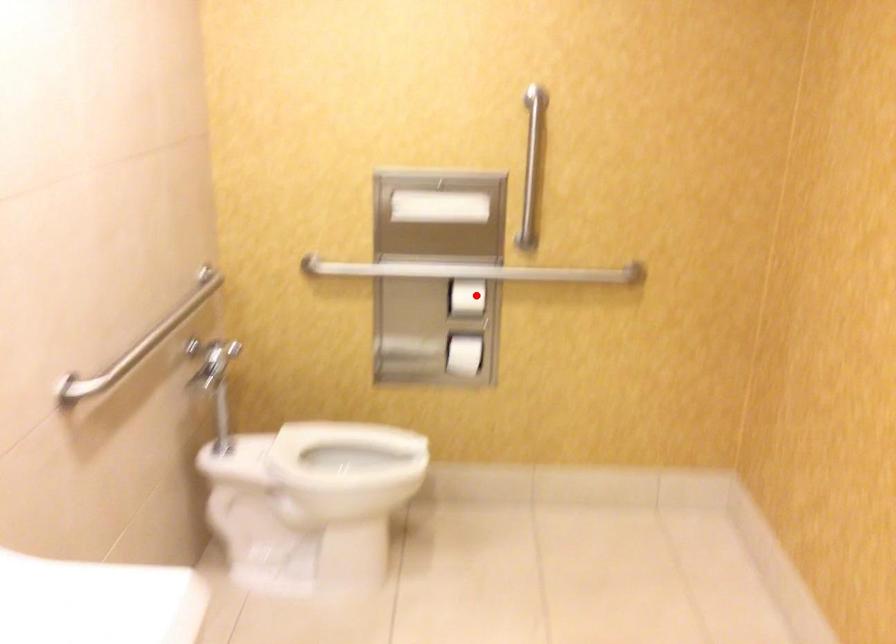
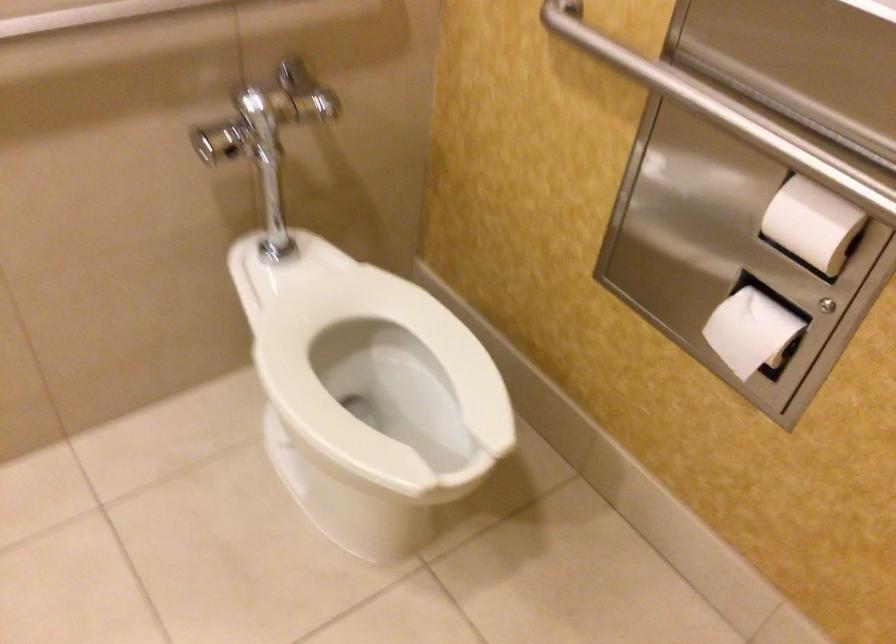
Locate, in the second image, the point that corresponds to the highlighted location in the first image.

(812, 223)